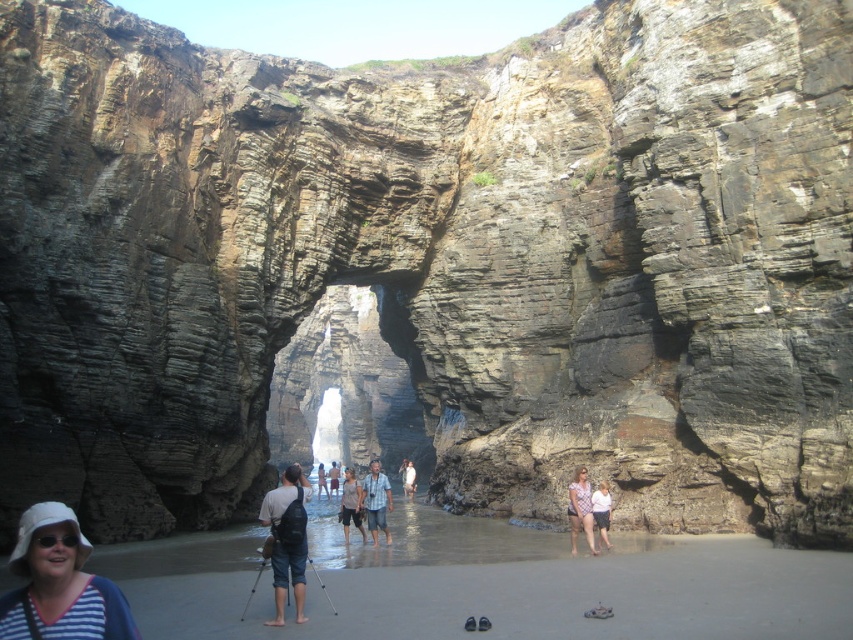
Between matte black backpack at center and light pink fabric dress at center, which one has more height?

matte black backpack at center is taller.

Between point (294, 477) and point (584, 484), which one is positioned behind?

The point (584, 484) is behind.

Is point (293, 490) in front of point (589, 506)?

Yes, point (293, 490) is in front of point (589, 506).

You are a GUI agent. You are given a task and a screenshot of the screen. Output one action in this format:
    pyautogui.click(x=<x>, y=<y>)
    Task: Click on the matte black backpack at center
    Image resolution: width=853 pixels, height=640 pixels.
    Given the screenshot: What is the action you would take?
    pyautogui.click(x=287, y=540)

Describe the element at coordinates (59, 582) in the screenshot. I see `white fabric hat at lower left` at that location.

Does white fabric hat at lower left come in front of light pink fabric dress at center?

Yes, it is in front of light pink fabric dress at center.

Measure the distance between white fabric hat at lower left and camera.

A distance of 105.99 feet exists between white fabric hat at lower left and camera.

At what (x,y) coordinates should I click in order to perform the action: click on white fabric hat at lower left. Please return your answer as a coordinate pair (x, y). The height and width of the screenshot is (640, 853). Looking at the image, I should click on (59, 582).

Consider the image. Does light pink fabric dress at center lie behind brown cotton shorts at center?

That is False.

Is light pink fabric dress at center smaller than brown cotton shorts at center?

Yes, light pink fabric dress at center is smaller than brown cotton shorts at center.

Locate an element on the screen. light pink fabric dress at center is located at coordinates point(579,508).